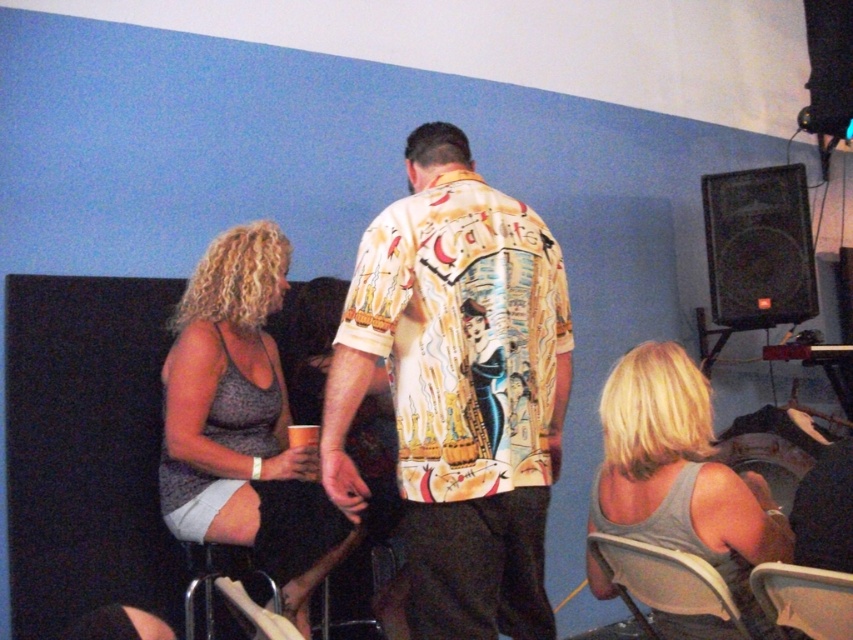
Consider the image. You are planning to host a small gathering and need to seat two guests. You have a white fabric chair at lower right and a white plastic chair at lower right available. Which chair can accommodate a guest with wider hips?

The white fabric chair at lower right has a larger width than the white plastic chair at lower right, so it can accommodate a guest with wider hips better.

You are at a party and need to move from the white fabric chair at lower right to the black plastic speaker at right. Which direction should you move to reach it?

You should move to the right to reach the black plastic speaker at right from the white fabric chair at lower right since it is located to the right of the chair.

You are at a party and need to place a tall plant between the black plastic speaker at right and the white fabric chair at lower right. Which object should the plant be placed closer to based on their heights?

The black plastic speaker at right is taller than the white fabric chair at lower right. Therefore, the tall plant should be placed closer to the black plastic speaker at right to maintain proportional spacing.